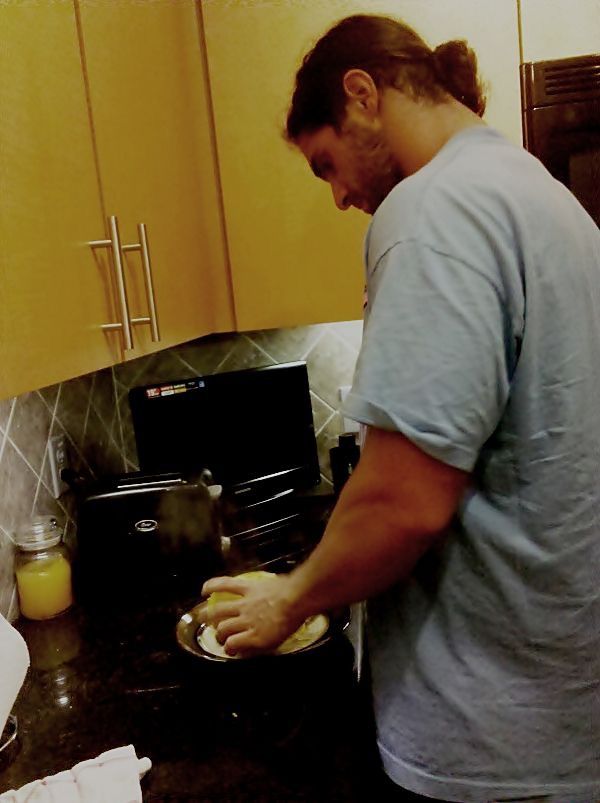
The image size is (600, 803). I want to click on shelf handles, so click(x=112, y=230), click(x=149, y=294).